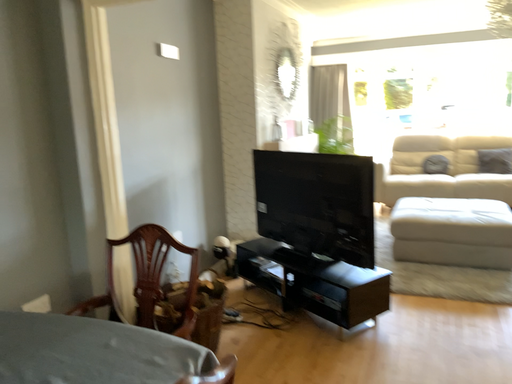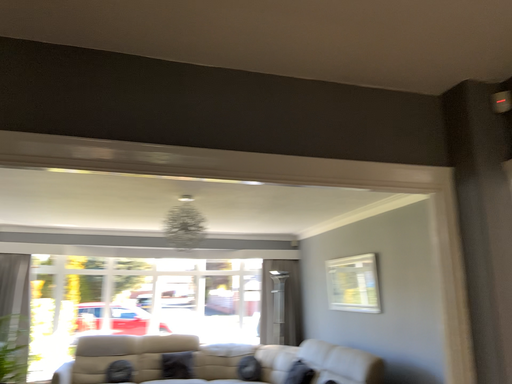
Question: Which way did the camera rotate in the video?

Choices:
 (A) rotated downward
 (B) rotated upward

Answer: (B)